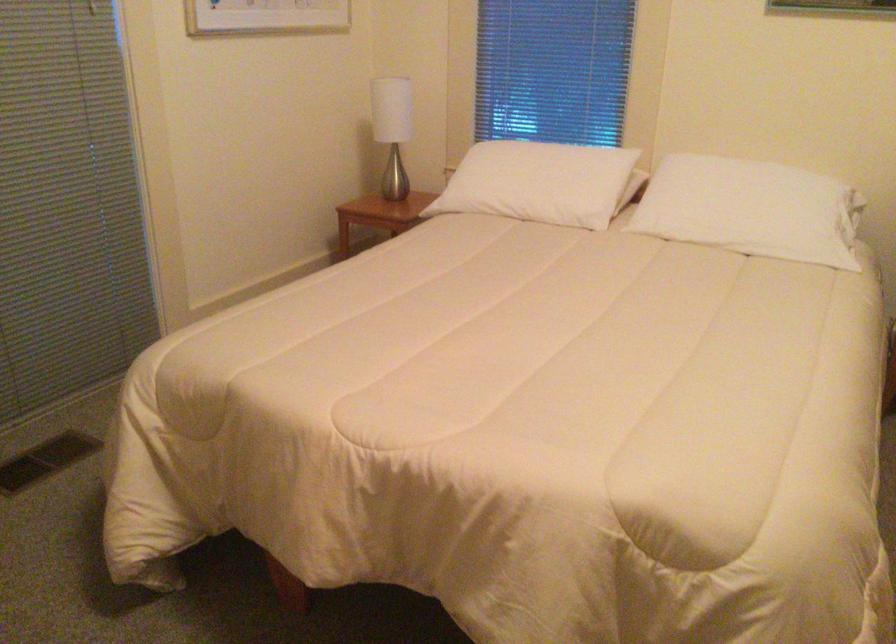
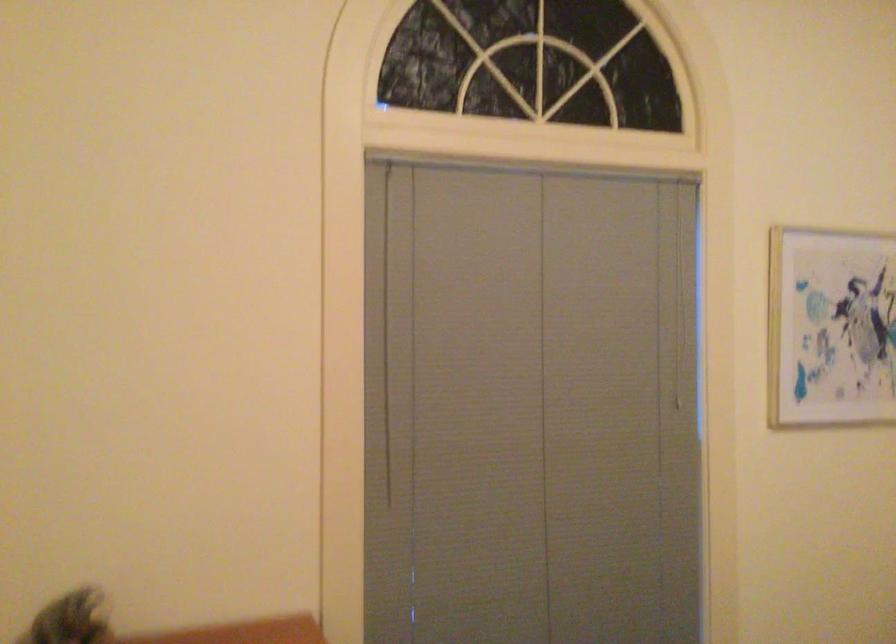
Based on the continuous images, in which direction is the camera rotating?

The camera rotated toward left-up.